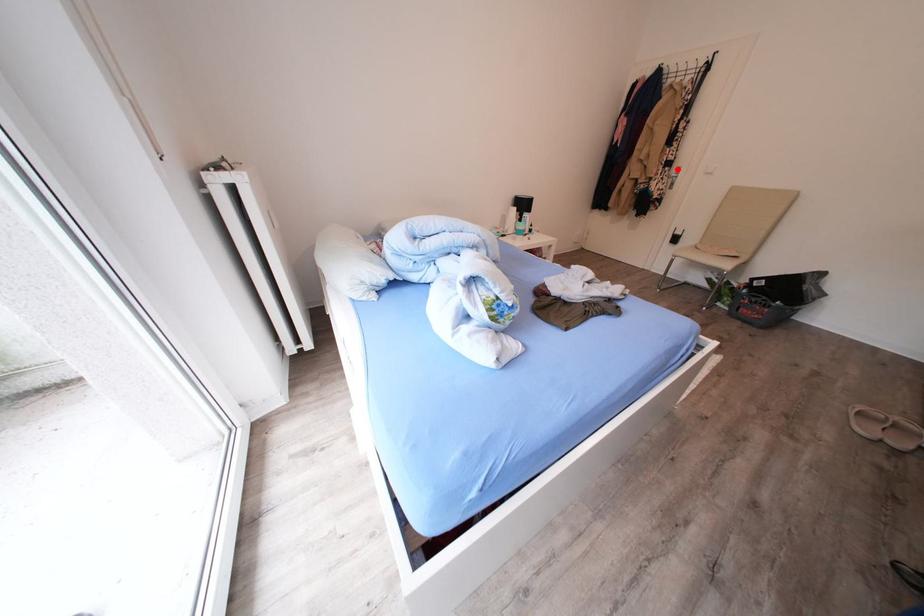
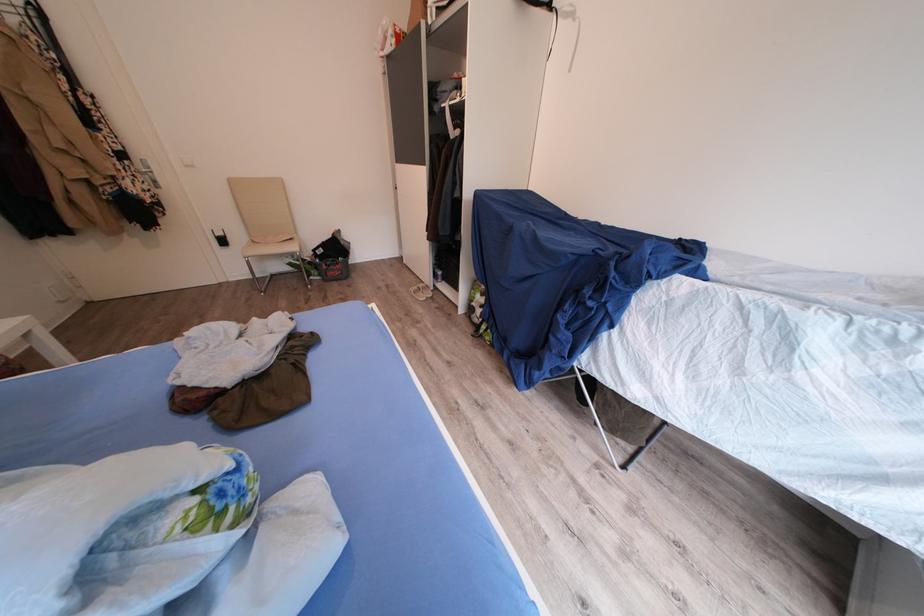
Question: A red point is marked in image1. In image2, is the corresponding 3D point closer to the camera or farther? Reply with the corresponding letter.

Choices:
 (A) The corresponding 3D point is closer.
 (B) The corresponding 3D point is farther.

Answer: (B)